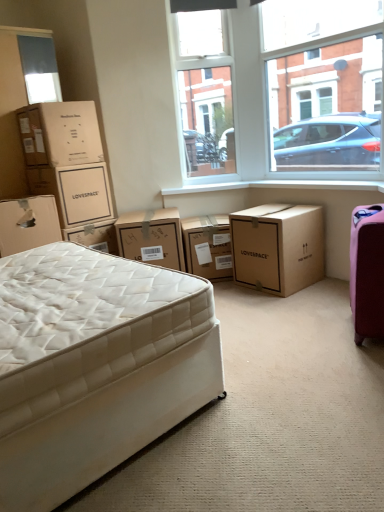
In order to face white cardboard box at left, arranged as the sixth box when viewed from the right, should I rotate leftwards or rightwards?

A 22.692 degree turn to the left will do.

This screenshot has width=384, height=512. I want to click on brown cardboard box at center, the 5th box positioned from the left, so click(208, 246).

Image resolution: width=384 pixels, height=512 pixels. I want to click on brown cardboard box at center, arranged as the 4th box when viewed from the left, so click(152, 237).

The image size is (384, 512). What do you see at coordinates (75, 191) in the screenshot?
I see `matte brown cardboard box at upper left, placed as the 4th box when sorted from right to left` at bounding box center [75, 191].

How much space does brown cardboard box at center, arranged as the first box when viewed from the right, occupy vertically?

It is 21.15 inches.

The width and height of the screenshot is (384, 512). Describe the element at coordinates (286, 91) in the screenshot. I see `clear glass window at upper center` at that location.

This screenshot has height=512, width=384. I want to click on white cardboard box at left, arranged as the sixth box when viewed from the right, so coord(28,224).

Is white smooth window sill at center looking in the opposite direction of brown cardboard box at center, placed as the 2th box when sorted from right to left?

No.

Does point (272, 187) appear closer or farther from the camera than point (202, 228)?

Point (272, 187) appears to be farther away from the viewer than point (202, 228).

From the image's perspective, is white smooth window sill at center located above or below brown cardboard box at center, placed as the 2th box when sorted from right to left?

Clearly, from the image's perspective, white smooth window sill at center is above brown cardboard box at center, placed as the 2th box when sorted from right to left.

Does white smooth window sill at center have a lesser width compared to brown cardboard box at center, the 5th box positioned from the left?

Correct, the width of white smooth window sill at center is less than that of brown cardboard box at center, the 5th box positioned from the left.

Could you tell me if white smooth window sill at center is facing matte brown cardboard box at upper left, acting as the third box starting from the left?

No, white smooth window sill at center is not turned towards matte brown cardboard box at upper left, acting as the third box starting from the left.

From the image's perspective, which one is positioned lower, white smooth window sill at center or matte brown cardboard box at upper left, placed as the 4th box when sorted from right to left?

matte brown cardboard box at upper left, placed as the 4th box when sorted from right to left, is shown below in the image.

Between white smooth window sill at center and matte brown cardboard box at upper left, placed as the 4th box when sorted from right to left, which one appears on the right side from the viewer's perspective?

From the viewer's perspective, white smooth window sill at center appears more on the right side.

Is white cardboard box at left, which is the 1th box from left to right, far away from white smooth window sill at center?

Yes, white cardboard box at left, which is the 1th box from left to right, and white smooth window sill at center are located far from each other.

Is white cardboard box at left, arranged as the sixth box when viewed from the right, smaller than white smooth window sill at center?

Incorrect, white cardboard box at left, arranged as the sixth box when viewed from the right, is not smaller in size than white smooth window sill at center.

Identify the location of window sill above the white cardboard box at left, arranged as the sixth box when viewed from the right (from the image's perspective). (276, 186).

Is white cardboard box at left, which is the 1th box from left to right, smaller than brown cardboard box at center, the 5th box positioned from the left?

No, white cardboard box at left, which is the 1th box from left to right, is not smaller than brown cardboard box at center, the 5th box positioned from the left.

Does white cardboard box at left, which is the 1th box from left to right, have a greater width compared to brown cardboard box at center, placed as the 2th box when sorted from right to left?

Indeed, white cardboard box at left, which is the 1th box from left to right, has a greater width compared to brown cardboard box at center, placed as the 2th box when sorted from right to left.

Which object is closer to the camera taking this photo, white cardboard box at left, which is the 1th box from left to right, or brown cardboard box at center, placed as the 2th box when sorted from right to left?

white cardboard box at left, which is the 1th box from left to right, is closer to the camera.

Is white cardboard box at left, which is the 1th box from left to right, outside of brown cardboard box at center, placed as the 2th box when sorted from right to left?

That's correct, white cardboard box at left, which is the 1th box from left to right, is outside of brown cardboard box at center, placed as the 2th box when sorted from right to left.

Can you tell me how much white cardboard box at left, which is the 1th box from left to right, and pink fabric suitcase at right differ in facing direction?

The angle between the facing direction of white cardboard box at left, which is the 1th box from left to right, and the facing direction of pink fabric suitcase at right is 150 degrees.

Is white cardboard box at left, arranged as the sixth box when viewed from the right, far from pink fabric suitcase at right?

Yes, white cardboard box at left, arranged as the sixth box when viewed from the right, is far from pink fabric suitcase at right.

Could you tell me if white cardboard box at left, which is the 1th box from left to right, is turned towards pink fabric suitcase at right?

No, white cardboard box at left, which is the 1th box from left to right, is not aimed at pink fabric suitcase at right.

Is white cardboard box at left, which is the 1th box from left to right, located outside pink fabric suitcase at right?

Yes, white cardboard box at left, which is the 1th box from left to right, is outside of pink fabric suitcase at right.

In the scene shown: From a real-world perspective, between transparent glass window at upper center and brown cardboard box at center, the 5th box positioned from the left, who is vertically higher?

transparent glass window at upper center is physically above.

Is transparent glass window at upper center to the right of brown cardboard box at center, the 5th box positioned from the left, from the viewer's perspective?

Yes.

Considering the sizes of objects transparent glass window at upper center and brown cardboard box at center, the 5th box positioned from the left, in the image provided, who is smaller, transparent glass window at upper center or brown cardboard box at center, the 5th box positioned from the left,?

Smaller between the two is transparent glass window at upper center.

Is transparent glass window at upper center far from brown cardboard box at center, the 5th box positioned from the left?

That's not correct — transparent glass window at upper center is a little close to brown cardboard box at center, the 5th box positioned from the left.

Find the location of a particular element. The image size is (384, 512). luggage located below the brown cardboard box at center, placed as the 2th box when sorted from right to left (from the image's perspective) is located at coordinates pos(367,271).

Considering the relative sizes of brown cardboard box at center, placed as the 2th box when sorted from right to left, and pink fabric suitcase at right in the image provided, is brown cardboard box at center, placed as the 2th box when sorted from right to left, wider than pink fabric suitcase at right?

Yes.

Are brown cardboard box at center, placed as the 2th box when sorted from right to left, and pink fabric suitcase at right beside each other?

No, brown cardboard box at center, placed as the 2th box when sorted from right to left, is not with pink fabric suitcase at right.

What are the coordinates of `the 5th box behind the white smooth window sill at center, starting your count from the anchor` in the screenshot? It's located at (208, 246).

From the image's perspective, which box is the 1st one below the white smooth window sill at center? Please provide its 2D coordinates.

[(75, 191)]

Considering their positions, is white smooth window sill at center positioned further to brown cardboard box at upper left, which is the fifth box in right-to-left order, than pink fabric suitcase at right?

Based on the image, pink fabric suitcase at right appears to be further to brown cardboard box at upper left, which is the fifth box in right-to-left order.

From the image, which object appears to be nearer to brown cardboard box at upper left, which is the 2th box in left-to-right order, transparent glass window at upper center or white cardboard box at left, which is the 1th box from left to right?

white cardboard box at left, which is the 1th box from left to right, lies closer to brown cardboard box at upper left, which is the 2th box in left-to-right order, than the other object.

From the picture: Based on their spatial positions, is transparent glass window at upper center or brown cardboard box at upper left, which is the 2th box in left-to-right order, closer to white cardboard box at left, arranged as the sixth box when viewed from the right?

Among the two, brown cardboard box at upper left, which is the 2th box in left-to-right order, is located nearer to white cardboard box at left, arranged as the sixth box when viewed from the right.

Based on their spatial positions, is brown cardboard box at upper left, which is the 2th box in left-to-right order, or transparent glass window at upper center closer to white quilted mattress at lower left?

brown cardboard box at upper left, which is the 2th box in left-to-right order, lies closer to white quilted mattress at lower left than the other object.

Looking at the image, which one is located closer to matte brown cardboard box at upper left, placed as the 4th box when sorted from right to left, white quilted mattress at lower left or pink fabric suitcase at right?

The object closer to matte brown cardboard box at upper left, placed as the 4th box when sorted from right to left, is white quilted mattress at lower left.

Looking at the image, which one is located closer to brown cardboard box at upper left, which is the 2th box in left-to-right order, pink fabric suitcase at right or white cardboard box at left, which is the 1th box from left to right?

white cardboard box at left, which is the 1th box from left to right, is closer to brown cardboard box at upper left, which is the 2th box in left-to-right order.

When comparing their distances from white quilted mattress at lower left, does white smooth window sill at center or matte brown cardboard box at upper left, acting as the third box starting from the left, seem further?

white smooth window sill at center lies further to white quilted mattress at lower left than the other object.

Based on their spatial positions, is white quilted mattress at lower left or clear glass window at upper center further from white cardboard box at left, arranged as the sixth box when viewed from the right?

clear glass window at upper center is positioned further to the anchor white cardboard box at left, arranged as the sixth box when viewed from the right.

Find the location of a particular element. This screenshot has width=384, height=512. bed between white cardboard box at left, which is the 1th box from left to right, and clear glass window at upper center, in the horizontal direction is located at coordinates (95, 366).

You are a GUI agent. You are given a task and a screenshot of the screen. Output one action in this format:
    pyautogui.click(x=<x>, y=<y>)
    Task: Click on the window situated between white quilted mattress at lower left and pink fabric suitcase at right from left to right
    Image resolution: width=384 pixels, height=512 pixels.
    Given the screenshot: What is the action you would take?
    pyautogui.click(x=286, y=91)

Find the location of a particular element. box between matte brown cardboard box at upper left, acting as the third box starting from the left, and brown cardboard box at center, placed as the 2th box when sorted from right to left is located at coordinates (152, 237).

This screenshot has height=512, width=384. Find the location of `window located between brown cardboard box at upper left, which is the fifth box in right-to-left order, and white smooth window sill at center in the left-right direction`. window located between brown cardboard box at upper left, which is the fifth box in right-to-left order, and white smooth window sill at center in the left-right direction is located at coordinates (286, 91).